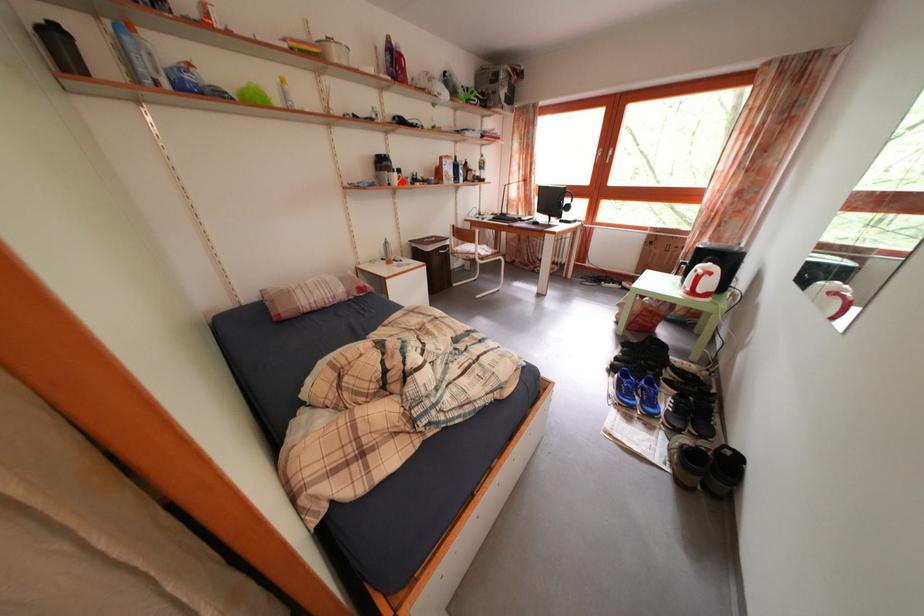
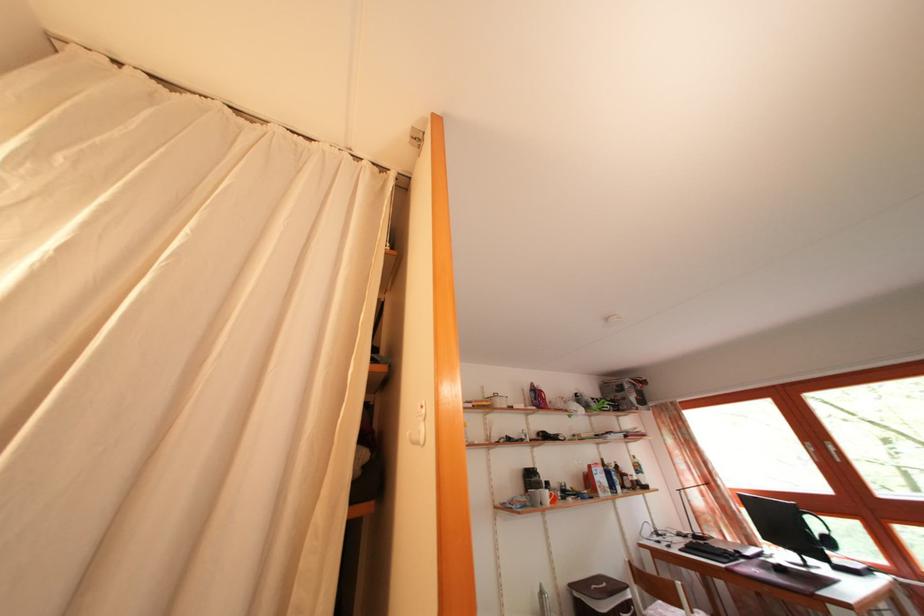
Find the pixel in the second image that matches the highlighted location in the first image.

(554, 499)